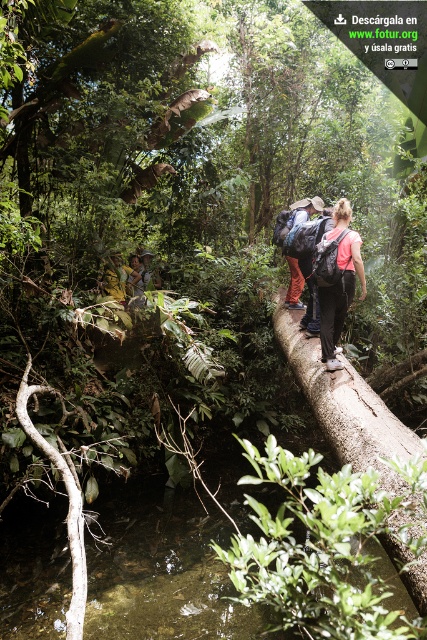
You are a hiker trying to cross the stream in the jungle. You see the brown rough tree trunk at center and the pink fabric backpack at center. Which object is closer to the water surface?

The brown rough tree trunk at center is below the pink fabric backpack at center, so the tree trunk is closer to the water surface.

You are a hiker trying to locate a pink fabric backpack in the jungle scene. Based on the coordinates provided, in which direction should you move relative to your current position at point A located at coordinates 0,0 to reach the pink fabric backpack at center?

The pink fabric backpack at center is located at coordinates (336, 280). Since your current position is at (0, 0), you should move northeast to reach it.

You are a hiker trying to cross the stream in the jungle. You see the brown rough tree trunk at center and the matte brown backpack at center. Which object is larger in size?

The brown rough tree trunk at center is bigger than the matte brown backpack at center, so the brown rough tree trunk at center is larger in size.